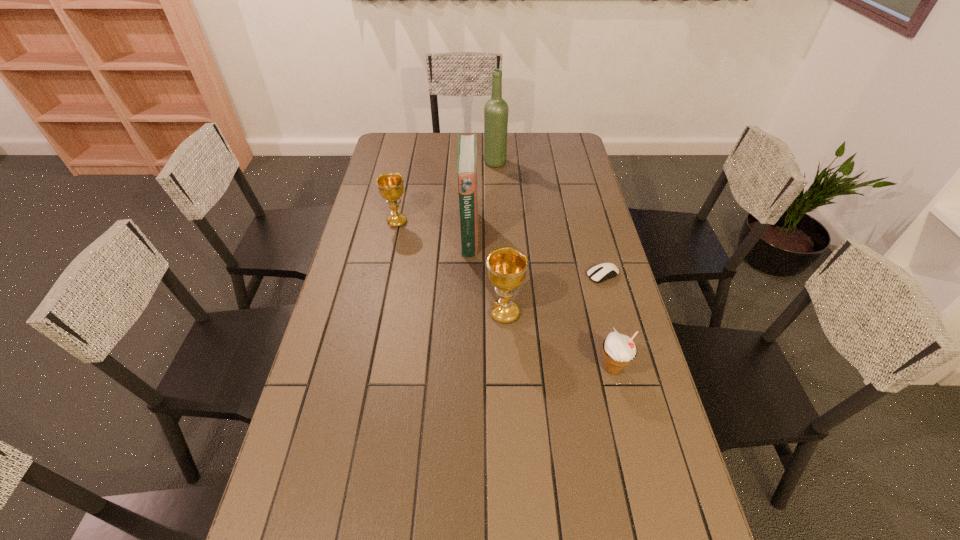
Locate an element on the screen. blank region between the second tallest object and the icecream is located at coordinates (540, 301).

This screenshot has height=540, width=960. Identify the location of blank region between the left chalice and the farthest object. (446, 192).

Where is `empty space between the fifth object from right to left and the wine bottle`? empty space between the fifth object from right to left and the wine bottle is located at coordinates (482, 198).

Find the location of `vacant space in between the wine bottle and the taller chalice`. vacant space in between the wine bottle and the taller chalice is located at coordinates (500, 238).

Find the location of a particular element. the second closest object to the shorter chalice is located at coordinates (496, 109).

Find the location of a particular element. The width and height of the screenshot is (960, 540). object that is the fifth nearest to the second tallest object is located at coordinates click(619, 350).

Where is `vacant space that satisfies the following two spatial constraints: 1. on the back side of the third tallest object; 2. on the cover of the hardback book`? vacant space that satisfies the following two spatial constraints: 1. on the back side of the third tallest object; 2. on the cover of the hardback book is located at coordinates (501, 234).

In order to click on vacant space that satisfies the following two spatial constraints: 1. on the cover of the fifth object from right to left; 2. on the left side of the mouse in this screenshot , I will do `click(468, 275)`.

The width and height of the screenshot is (960, 540). What are the coordinates of `vacant space that satisfies the following two spatial constraints: 1. on the back side of the nearest object; 2. on the left side of the shortest object` in the screenshot? It's located at (589, 275).

Locate an element on the screen. The image size is (960, 540). free location that satisfies the following two spatial constraints: 1. on the cover of the right chalice; 2. on the left side of the fifth object from right to left is located at coordinates (468, 313).